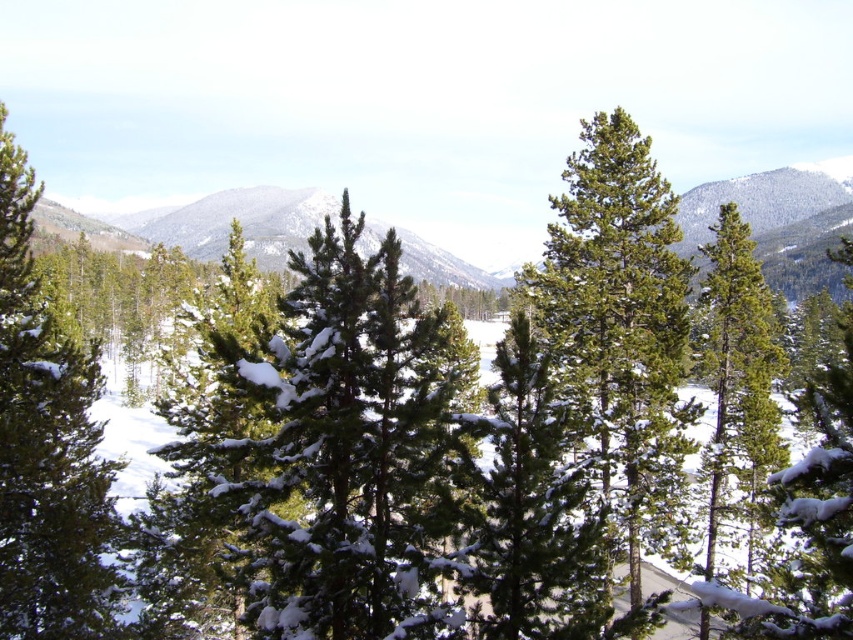
Question: Does green matte tree at center lie in front of green matte tree at left?

Choices:
 (A) no
 (B) yes

Answer: (B)

Question: Which point is closer to the camera taking this photo?

Choices:
 (A) (15, 403)
 (B) (434, 580)
 (C) (587, 376)

Answer: (B)

Question: Is green matte tree at center below green needle-like at center?

Choices:
 (A) no
 (B) yes

Answer: (B)

Question: Which of the following is the closest to the observer?

Choices:
 (A) (746, 484)
 (B) (3, 568)
 (C) (570, 230)
 (D) (287, 387)

Answer: (D)

Question: Can you confirm if green needle-like at center is thinner than green matte tree at left?

Choices:
 (A) yes
 (B) no

Answer: (B)

Question: Which of the following is the closest to the observer?

Choices:
 (A) (3, 208)
 (B) (612, 128)
 (C) (769, 454)
 (D) (424, 557)

Answer: (D)